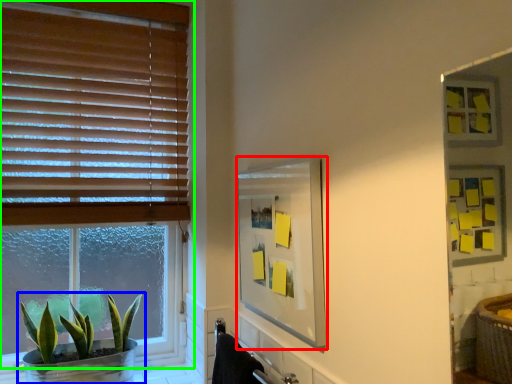
Question: Which object is positioned closest to mirror (highlighted by a red box)? Select from houseplant (highlighted by a blue box) and window (highlighted by a green box).

Choices:
 (A) houseplant
 (B) window

Answer: (B)